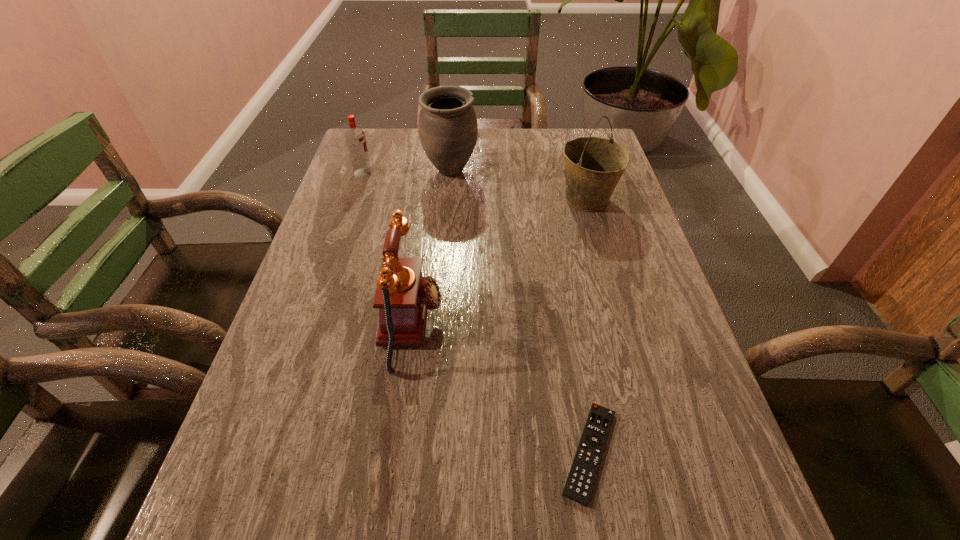
This screenshot has width=960, height=540. I want to click on free space between the shortest object and the wine bucket, so click(x=588, y=326).

The width and height of the screenshot is (960, 540). Find the location of `unoccupied area between the remote control and the telephone`. unoccupied area between the remote control and the telephone is located at coordinates (501, 388).

The width and height of the screenshot is (960, 540). I want to click on empty space between the urn and the leftmost object, so click(x=407, y=172).

This screenshot has width=960, height=540. Find the location of `vacant point located between the telephone and the remote control`. vacant point located between the telephone and the remote control is located at coordinates (501, 388).

The width and height of the screenshot is (960, 540). Find the location of `empty space between the urn and the vodka`. empty space between the urn and the vodka is located at coordinates (407, 172).

The height and width of the screenshot is (540, 960). Find the location of `unoccupied area between the urn and the second nearest object`. unoccupied area between the urn and the second nearest object is located at coordinates (431, 248).

Find the location of a particular element. The image size is (960, 540). free spot between the shortest object and the urn is located at coordinates (520, 312).

Identify the location of empty location between the fourth farthest object and the nearest object. This screenshot has height=540, width=960. (501, 388).

The image size is (960, 540). I want to click on object that stands as the closest to the vodka, so click(448, 129).

You are a GUI agent. You are given a task and a screenshot of the screen. Output one action in this format:
    pyautogui.click(x=<x>, y=<y>)
    Task: Click on the closest object relative to the wine bucket
    Image resolution: width=960 pixels, height=540 pixels.
    Given the screenshot: What is the action you would take?
    pyautogui.click(x=448, y=129)